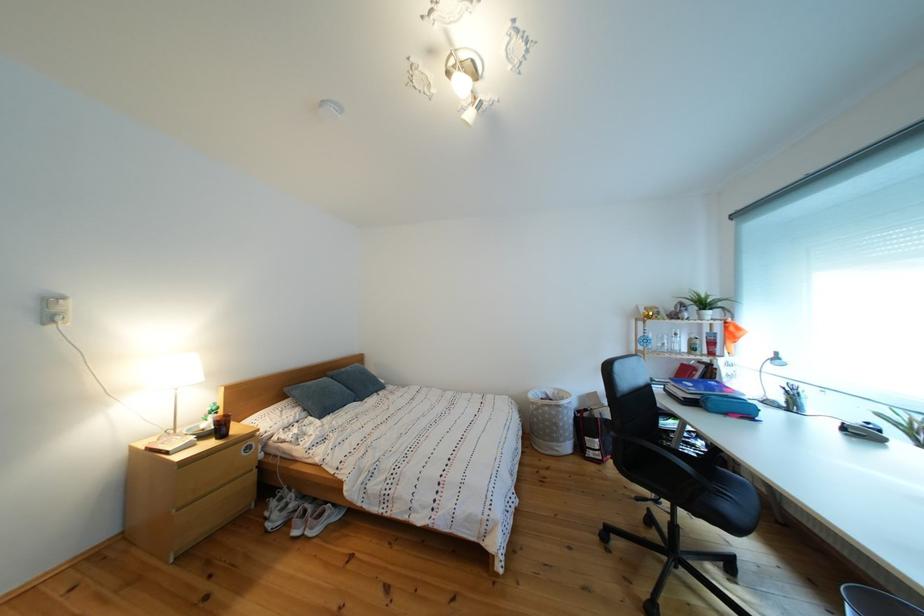
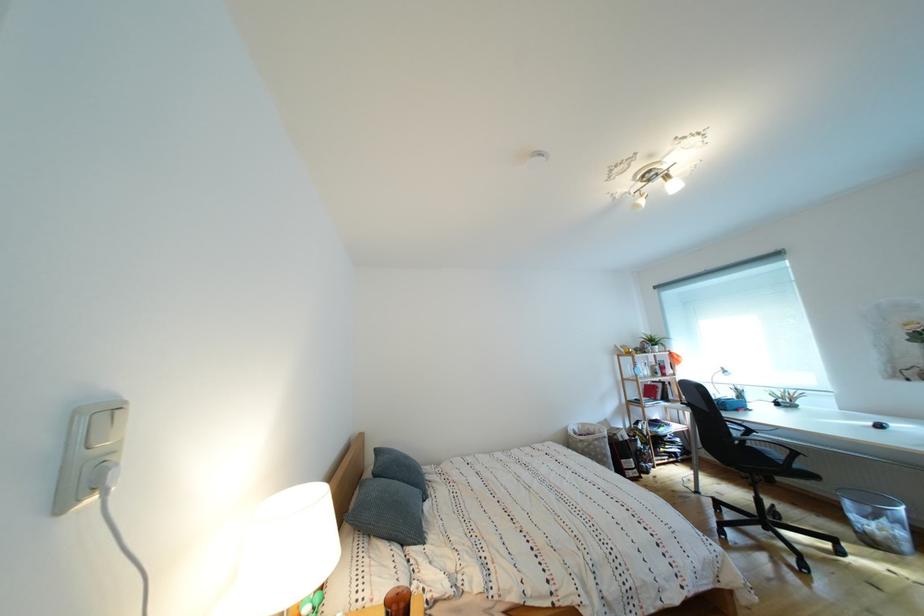
Locate, in the second image, the point that corresponds to pixel 683 358 in the first image.

(657, 383)